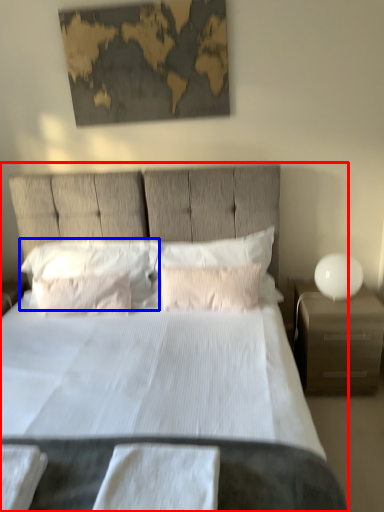
Question: Which point is closer to the camera, bed (highlighted by a red box) or pillow (highlighted by a blue box)?

Choices:
 (A) bed
 (B) pillow

Answer: (A)